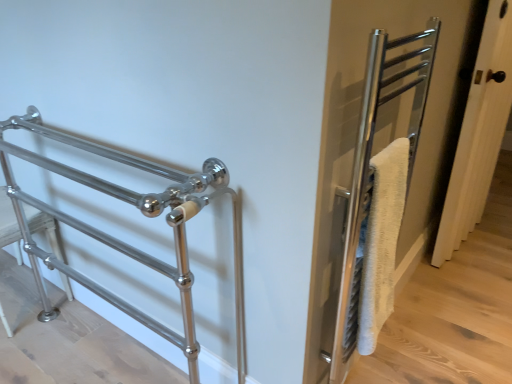
Question: Should I look upward or downward to see white wood door at right?

Choices:
 (A) up
 (B) down

Answer: (A)

Question: Can we say white wood door at right lies outside polished metal towel rack at left?

Choices:
 (A) no
 (B) yes

Answer: (B)

Question: Does white wood door at right come in front of polished metal towel rack at left?

Choices:
 (A) no
 (B) yes

Answer: (A)

Question: Is white wood door at right looking in the opposite direction of polished metal towel rack at left?

Choices:
 (A) yes
 (B) no

Answer: (B)

Question: Is white wood door at right to the right of polished metal towel rack at left from the viewer's perspective?

Choices:
 (A) yes
 (B) no

Answer: (A)

Question: From a real-world perspective, is white wood door at right beneath polished metal towel rack at left?

Choices:
 (A) no
 (B) yes

Answer: (A)

Question: Does white wood door at right have a lesser height compared to polished metal towel rack at left?

Choices:
 (A) yes
 (B) no

Answer: (B)

Question: Does polished metal towel rack at left come behind white wood door at right?

Choices:
 (A) yes
 (B) no

Answer: (B)

Question: Does polished metal towel rack at left have a larger size compared to white wood door at right?

Choices:
 (A) yes
 (B) no

Answer: (A)

Question: From the image's perspective, is polished metal towel rack at left on white wood door at right?

Choices:
 (A) no
 (B) yes

Answer: (A)

Question: Is polished metal towel rack at left outside white wood door at right?

Choices:
 (A) yes
 (B) no

Answer: (A)

Question: Considering the relative sizes of polished metal towel rack at left and white wood door at right in the image provided, is polished metal towel rack at left shorter than white wood door at right?

Choices:
 (A) yes
 (B) no

Answer: (A)

Question: Are polished metal towel rack at left and white wood door at right located far from each other?

Choices:
 (A) yes
 (B) no

Answer: (A)

Question: Is polished metal towel rack at left inside the boundaries of white wood door at right, or outside?

Choices:
 (A) outside
 (B) inside

Answer: (A)